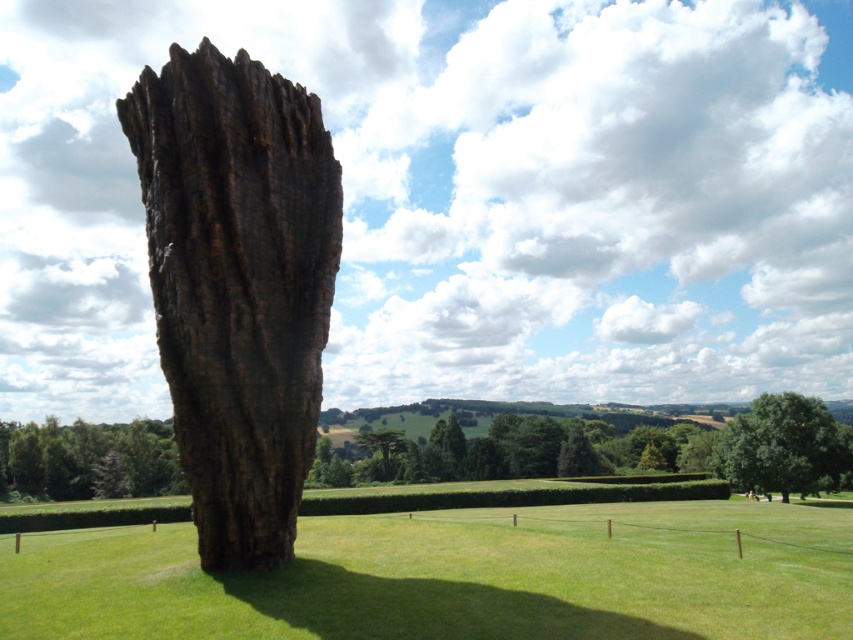
You are standing in the park and want to take a photo of the rustic wood sculpture at center and the dark brown textured tree trunk at lower left. Which object should you focus on first if you want both to be in sharp focus?

You should focus on the rustic wood sculpture at center first because it is closer to the viewer than the dark brown textured tree trunk at lower left, so focusing on the closer object will keep both in focus.

You are standing in the park and want to take a photo of the rustic wood sculpture at center and the dark brown textured tree trunk at lower left. Which object should you position to the left side of your camera frame to include both in the photo?

To include both the rustic wood sculpture at center and the dark brown textured tree trunk at lower left in your photo, you should position the dark brown textured tree trunk at lower left on the left side of your camera frame since the rustic wood sculpture at center is already on the right side of it.